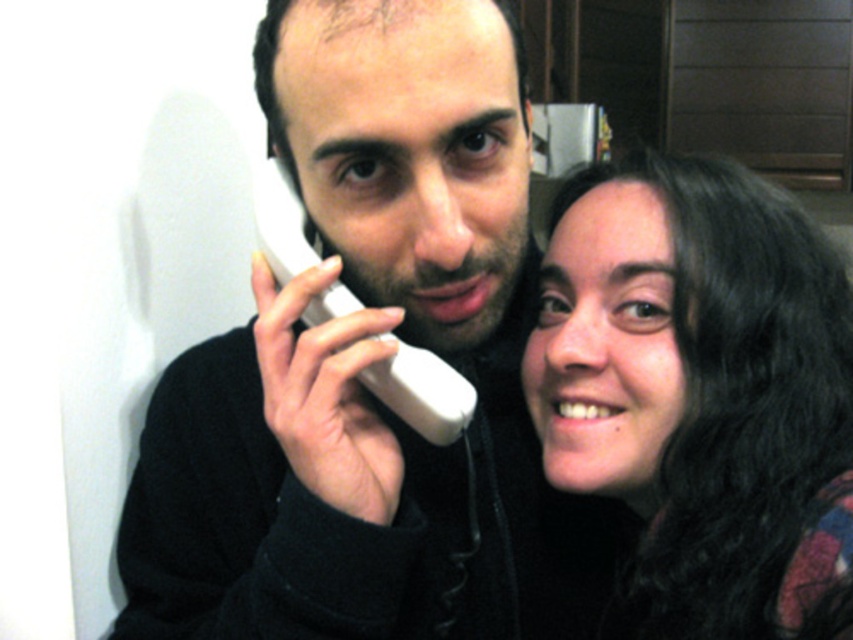
You are a photographer trying to capture a closeup of the smooth dark hair at right and the white plastic phone at center. Which object should you zoom in more on to ensure both are in focus?

The smooth dark hair at right is larger than the white plastic phone at center, so you should focus more on the smooth dark hair at right to ensure both are in focus.

You are a photographer trying to capture a portrait of the smooth dark hair at right and the white plastic phone at center. Which object is wider when viewed from your camera lens?

The smooth dark hair at right is wider than the white plastic phone at center according to the description.

You are a photographer trying to capture a portrait of the two people in the scene. You want to ensure that both the smooth dark hair at right and the white plastic phone at center are clearly visible in the frame. Based on their heights, which object should you focus on first to ensure proper depth of field?

The smooth dark hair at right is taller than the white plastic phone at center, so focusing on the smooth dark hair at right first will help ensure both are in focus due to its greater height.